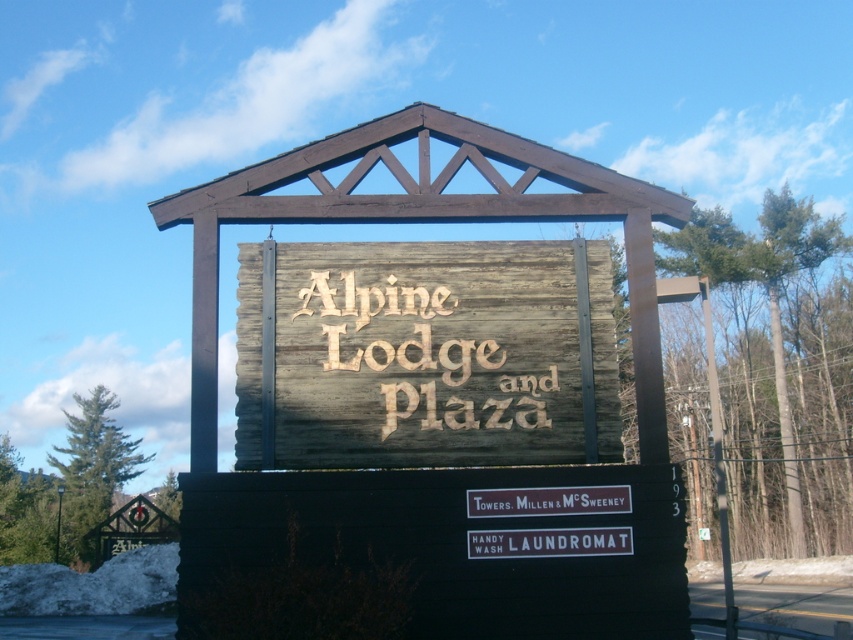
You are standing at the camera position and want to take a photo of the weathered wood sign at center. Is the sign within the camera range of 15 meters?

The weathered wood sign at center and camera are 13.35 meters apart, so yes, the sign is within the camera range of 15 meters.